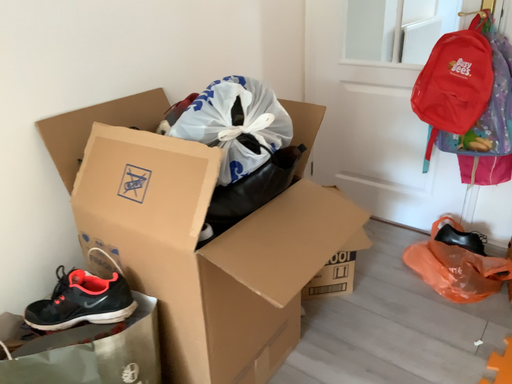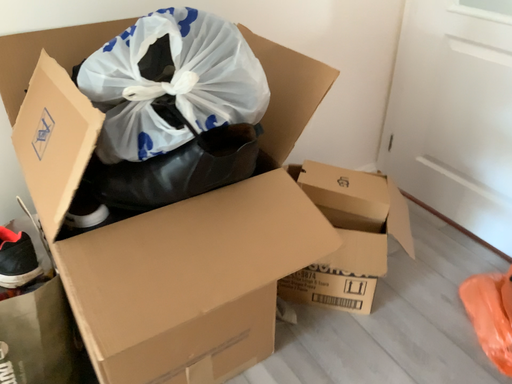
Question: How did the camera likely rotate when shooting the video?

Choices:
 (A) rotated upward
 (B) rotated downward

Answer: (B)